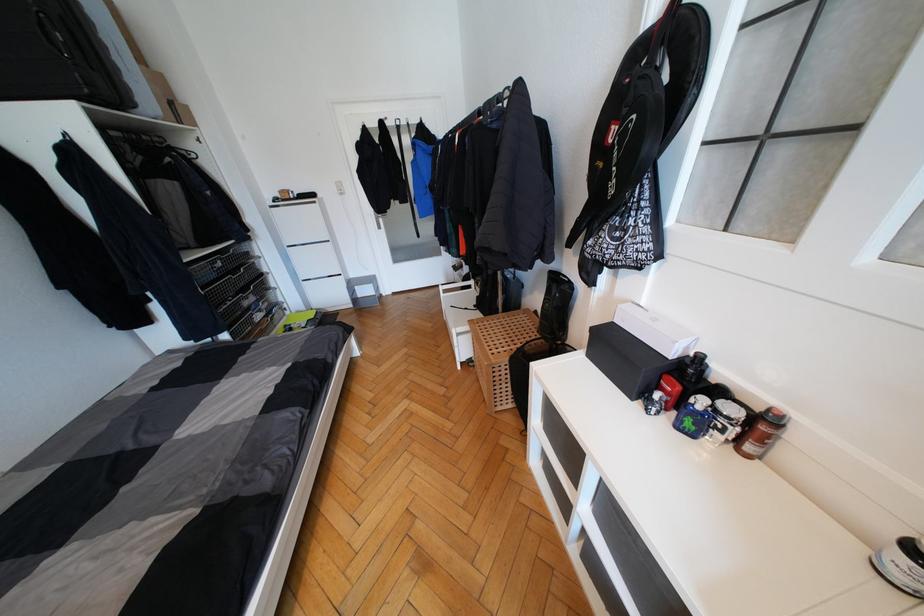
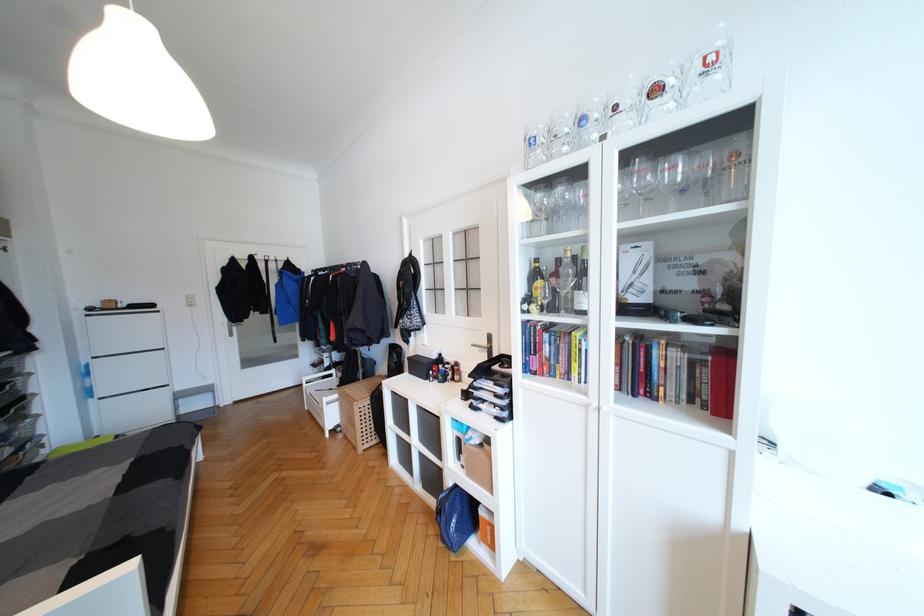
Where in the second image is the point corresponding to (640,392) from the first image?

(431, 378)